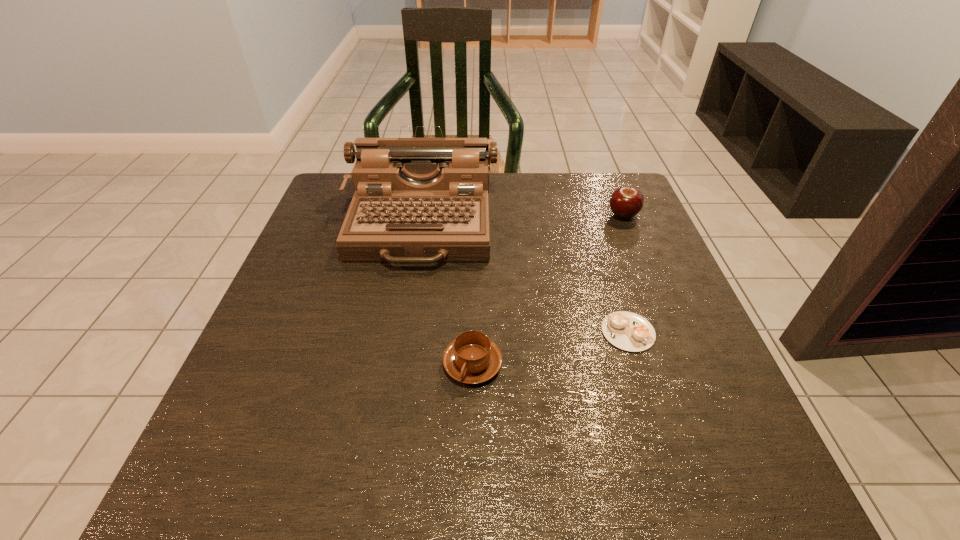
Image resolution: width=960 pixels, height=540 pixels. I want to click on vacant space that's between the third shortest object and the tallest object, so click(521, 220).

The width and height of the screenshot is (960, 540). I want to click on free area in between the apple and the tallest object, so click(x=521, y=220).

You are a GUI agent. You are given a task and a screenshot of the screen. Output one action in this format:
    pyautogui.click(x=<x>, y=<y>)
    Task: Click on the empty space that is in between the typewriter and the left cappuccino
    
    Given the screenshot: What is the action you would take?
    pyautogui.click(x=446, y=294)

Where is `free space between the taller cappuccino and the third shortest object`? Image resolution: width=960 pixels, height=540 pixels. free space between the taller cappuccino and the third shortest object is located at coordinates (548, 289).

Locate which object is the second closest to the typewriter. Please provide its 2D coordinates. Your answer should be formatted as a tuple, i.e. [(x, y)], where the tuple contains the x and y coordinates of a point satisfying the conditions above.

[(628, 331)]

You are a GUI agent. You are given a task and a screenshot of the screen. Output one action in this format:
    pyautogui.click(x=<x>, y=<y>)
    Task: Click on the third closest object to the apple
    The height and width of the screenshot is (540, 960).
    Given the screenshot: What is the action you would take?
    pyautogui.click(x=472, y=358)

Locate an element on the screen. The height and width of the screenshot is (540, 960). free space that satisfies the following two spatial constraints: 1. on the back side of the right cappuccino; 2. on the right side of the second tallest object is located at coordinates (591, 215).

Identify the location of free space that satisfies the following two spatial constraints: 1. on the keyboard of the tallest object; 2. on the left side of the shorter cappuccino. (402, 332).

Locate an element on the screen. This screenshot has width=960, height=540. vacant position in the image that satisfies the following two spatial constraints: 1. on the keyboard of the right cappuccino; 2. on the right side of the tallest object is located at coordinates (402, 332).